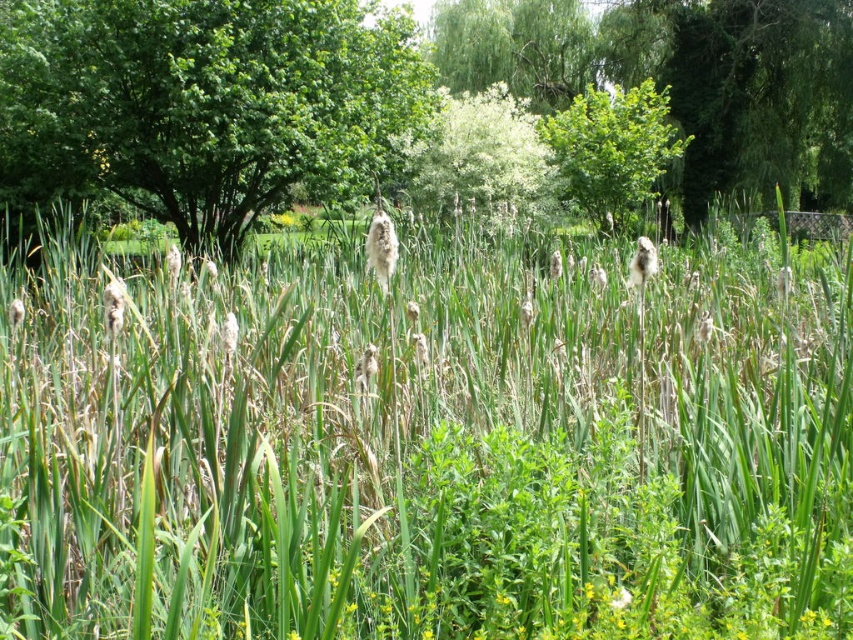
The width and height of the screenshot is (853, 640). What do you see at coordinates (204, 102) in the screenshot? I see `green leafy tree at upper left` at bounding box center [204, 102].

Can you confirm if green leafy tree at upper left is positioned above green leafy tree at upper right?

No, green leafy tree at upper left is not above green leafy tree at upper right.

Where is `green leafy tree at upper left`? The width and height of the screenshot is (853, 640). green leafy tree at upper left is located at coordinates (204, 102).

Locate an element on the screen. green leafy tree at upper left is located at coordinates (204, 102).

Looking at this image, can you confirm if green grass at center is shorter than green leafy tree at upper center?

Yes, green grass at center is shorter than green leafy tree at upper center.

At what (x,y) coordinates should I click in order to perform the action: click on green grass at center. Please return your answer as a coordinate pair (x, y). The image size is (853, 640). Looking at the image, I should click on (426, 440).

Looking at this image, can you confirm if green leafy tree at upper right is positioned to the left of green leafy tree at upper center?

Incorrect, green leafy tree at upper right is not on the left side of green leafy tree at upper center.

Which is behind, point (697, 20) or point (572, 141)?

The point (697, 20) is more distant.

Is point (648, 13) in front of point (596, 99)?

No, (648, 13) is behind (596, 99).

The image size is (853, 640). Find the location of `green leafy tree at upper right`. green leafy tree at upper right is located at coordinates (747, 92).